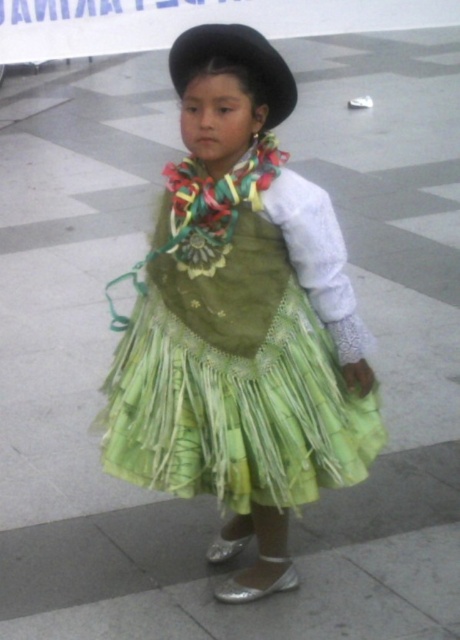
You are a photographer trying to capture the child in the image. You want to ensure the green woven dress at center is fully visible in the photo. Should you adjust your position to move closer to the black felt hat at upper center or move away from it?

The black felt hat at upper center is behind the green woven dress at center. To ensure the green woven dress at center is fully visible, you should move closer to the black felt hat at upper center so the hat doesn not block the dress.

You are a photographer setting up for a cultural event. You need to ensure the green woven dress at center and the black felt hat at upper center are both visible in the photo. Based on their positions, which one should you focus on first to ensure proper framing?

The black felt hat at upper center should be focused on first since it is positioned higher than the green woven dress at center, ensuring it stays within the frame.

You are a photographer setting up a camera at the origin point. The camera can only focus on objects within a 0.1 unit radius. Is the green woven dress at center within the camera focus range?

The green woven dress at center is located at point (230,356), which is outside the camera focus range of 0.1 unit radius from the origin. Therefore, the dress is not within the focus range.